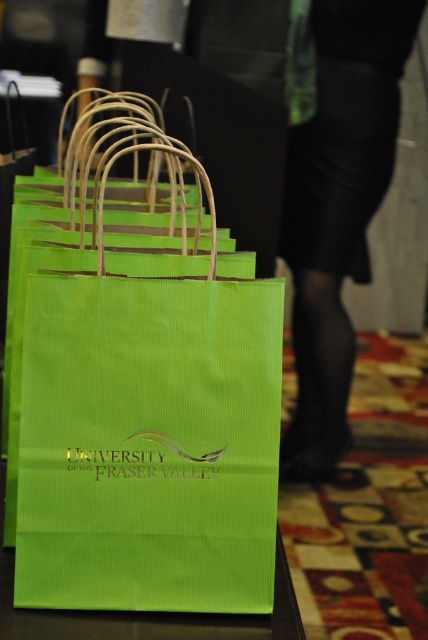
You are moving a cart that is 1.5 meters wide through a narrow hallway. There are two green paper bags in your path. The green paper bag at center and the matte green paper bag at lower left. Can you pass between them without touching either?

The distance between the green paper bag at center and the matte green paper bag at lower left is 1.57 meters, which is slightly wider than the cart. Therefore, the cart can pass through the space between them without touching either bag.

You are standing in front of the dark surface with the row of green paper bags. There is a specific point marked at coordinates (145,401). What object is located exactly at that point?

The green paper bag at center is located exactly at point (145,401).

Consider the image. You are organizing a university event and need to choose between the green paper bag at center and the matte green paper bag at lower left for promotional materials. Based on their size, which bag would allow for more items to be placed inside?

The matte green paper bag at lower left occupies more space than the green paper bag at center, so it can hold more items inside.